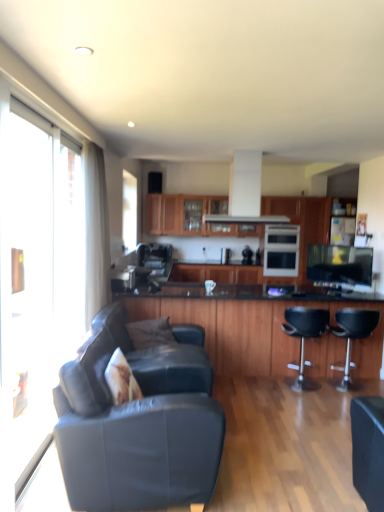
I want to click on free space underneath black leather bar stool at center right, acting as the first chair starting from the left (from a real-world perspective), so click(x=303, y=389).